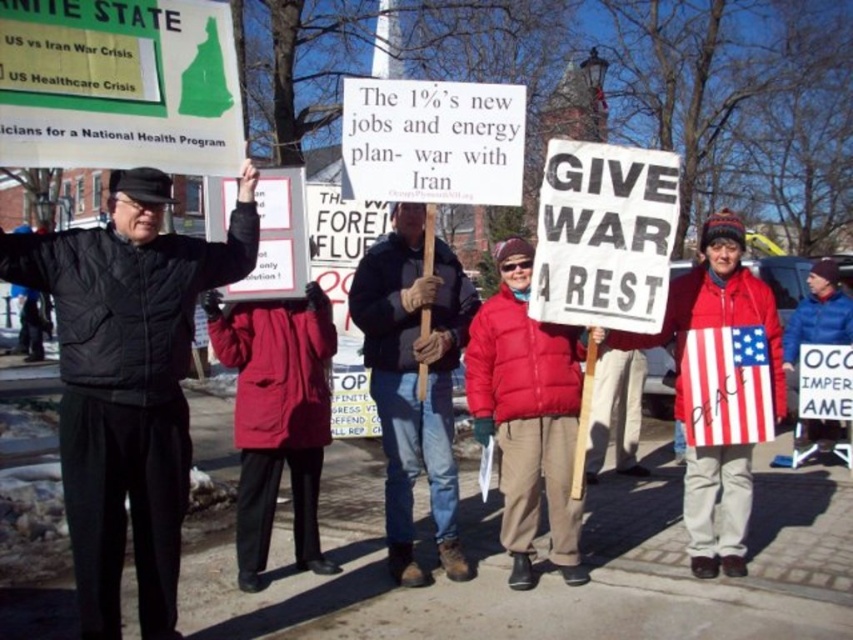
You are a photographer trying to capture a clear photo of both the black matte jacket at left and the dark blue jacket at center. Based on their positions, which jacket should you focus on first to ensure both are in the frame?

The black matte jacket at left is located above the dark blue jacket at center, so you should focus on the dark blue jacket at center first to ensure both are within the frame.